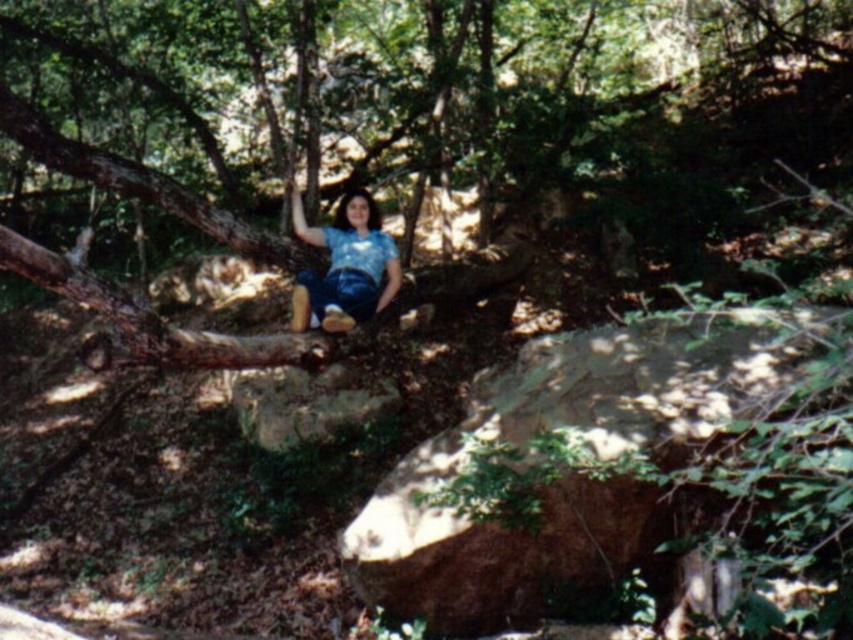
You are a hiker who wants to place a 6 feet long backpack between the brown rough rock at lower center and the brown rough tree trunk at left. Can the backpack fit in the space between them?

The distance between the brown rough rock at lower center and the brown rough tree trunk at left is 6.32 feet, so the 6 feet long backpack can fit in the space between them since it is slightly shorter than the available distance.

Consider the image. You are standing at the point labeled as point (570, 481) in the forest scene. What is the surface you are currently standing on?

The point (570, 481) is on brown rough rock at lower center, so you are standing on the brown rough rock at lower center.

You are standing in the forest and want to sit on the brown rough tree trunk at left. Based on its position, can you determine if it is closer to you or further away compared to the other objects in the scene?

The brown rough tree trunk at left is located at point [151,321], which places it centrally in the lower part of the scene, suggesting it is closer to the viewer than other distant elements in the forest. However, without additional spatial references, it is difficult to definitively compare its distance to all other objects. The coordinates indicate it is positioned near the center horizontally and lower vertically, typically closer in such scenes.